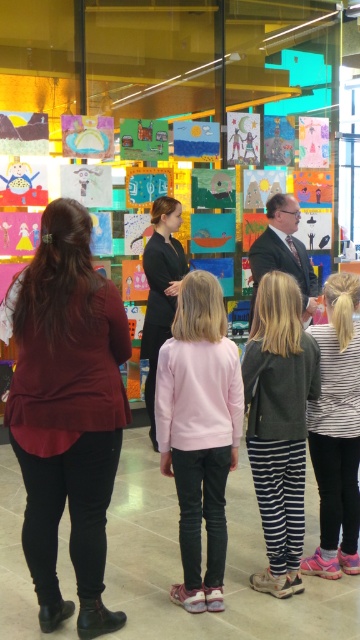
Question: Can you confirm if pink matte sweater at center is thinner than white striped shirt at right?

Choices:
 (A) yes
 (B) no

Answer: (B)

Question: Does matte burgundy blouse at center have a smaller size compared to pink matte sweater at center?

Choices:
 (A) no
 (B) yes

Answer: (A)

Question: Which of the following is the farthest from the observer?

Choices:
 (A) dark gray leather jacket at center
 (B) dark suit at center
 (C) black matte dress at center
 (D) white striped shirt at right

Answer: (C)

Question: Considering the relative positions of pink matte sweater at center and dark suit at center in the image provided, where is pink matte sweater at center located with respect to dark suit at center?

Choices:
 (A) right
 (B) left

Answer: (B)

Question: Which of the following is the closest to the observer?

Choices:
 (A) black matte dress at center
 (B) pink matte sweater at center
 (C) dark gray leather jacket at center
 (D) dark suit at center

Answer: (B)

Question: Which point is farther from the camera taking this photo?

Choices:
 (A) (155, 209)
 (B) (191, 429)
 (C) (96, 438)

Answer: (A)